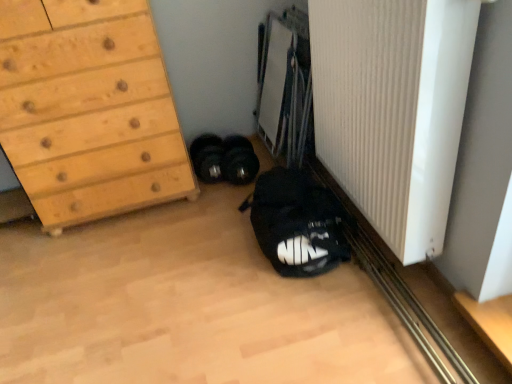
Question: Does black rubber dumbbells at center, marked as the second footwear in a left-to-right arrangement, appear on the left side of white ribbed radiator at lower right?

Choices:
 (A) yes
 (B) no

Answer: (A)

Question: From a real-world perspective, is black rubber dumbbells at center, acting as the 1th footwear starting from the right, located higher than white ribbed radiator at lower right?

Choices:
 (A) no
 (B) yes

Answer: (A)

Question: Is black rubber dumbbells at center, acting as the 1th footwear starting from the right, bigger than white ribbed radiator at lower right?

Choices:
 (A) no
 (B) yes

Answer: (A)

Question: Considering the relative sizes of black rubber dumbbells at center, marked as the second footwear in a left-to-right arrangement, and white ribbed radiator at lower right in the image provided, is black rubber dumbbells at center, marked as the second footwear in a left-to-right arrangement, shorter than white ribbed radiator at lower right?

Choices:
 (A) no
 (B) yes

Answer: (B)

Question: Is black rubber dumbbells at center, marked as the second footwear in a left-to-right arrangement, facing towards white ribbed radiator at lower right?

Choices:
 (A) no
 (B) yes

Answer: (A)

Question: Is black matte sneakers at lower left, placed as the second footwear when sorted from right to left, in front of or behind black fabric backpack at lower center in the image?

Choices:
 (A) front
 (B) behind

Answer: (B)

Question: Is black matte sneakers at lower left, which appears as the first footwear when viewed from the left, inside or outside of black fabric backpack at lower center?

Choices:
 (A) inside
 (B) outside

Answer: (B)

Question: From the image's perspective, is black matte sneakers at lower left, which appears as the first footwear when viewed from the left, located above or below black fabric backpack at lower center?

Choices:
 (A) below
 (B) above

Answer: (B)

Question: From a real-world perspective, is black matte sneakers at lower left, which appears as the first footwear when viewed from the left, positioned above or below black fabric backpack at lower center?

Choices:
 (A) below
 (B) above

Answer: (A)

Question: Is black rubber dumbbells at center, acting as the 1th footwear starting from the right, inside or outside of white ribbed radiator at lower right?

Choices:
 (A) inside
 (B) outside

Answer: (B)

Question: From the image's perspective, relative to white ribbed radiator at lower right, is black rubber dumbbells at center, acting as the 1th footwear starting from the right, above or below?

Choices:
 (A) above
 (B) below

Answer: (B)

Question: Does point pos(223,147) appear closer or farther from the camera than point pos(396,210)?

Choices:
 (A) closer
 (B) farther

Answer: (B)

Question: Is black rubber dumbbells at center, marked as the second footwear in a left-to-right arrangement, wider or thinner than white ribbed radiator at lower right?

Choices:
 (A) wide
 (B) thin

Answer: (A)

Question: Considering their positions, is white ribbed radiator at lower right located in front of or behind black rubber dumbbells at center, marked as the second footwear in a left-to-right arrangement?

Choices:
 (A) behind
 (B) front

Answer: (B)

Question: Considering the positions of white ribbed radiator at lower right and black rubber dumbbells at center, acting as the 1th footwear starting from the right, in the image, is white ribbed radiator at lower right wider or thinner than black rubber dumbbells at center, acting as the 1th footwear starting from the right,?

Choices:
 (A) wide
 (B) thin

Answer: (B)